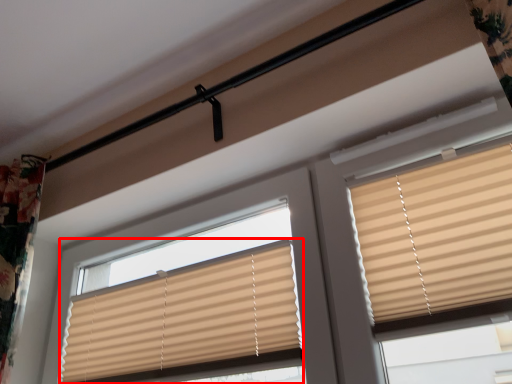
Question: Considering the relative positions of window blind (annotated by the red box) and window blind in the image provided, where is window blind (annotated by the red box) located with respect to the staircase?

Choices:
 (A) left
 (B) right

Answer: (A)